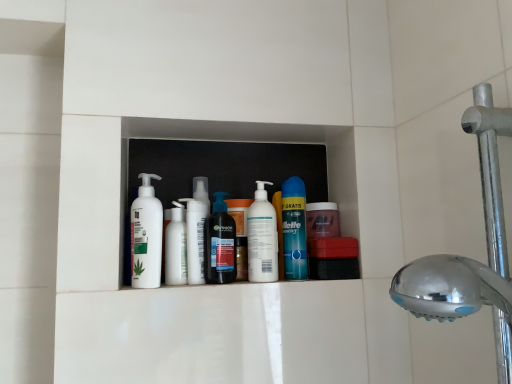
Question: From the image's perspective, is white matte lotion at center, acting as the 5th cleaning product starting from the right, located beneath white matte pump bottle at center, acting as the 4th cleaning product starting from the left?

Choices:
 (A) yes
 (B) no

Answer: (B)

Question: Is white matte lotion at center, acting as the 5th cleaning product starting from the right, outside of white matte pump bottle at center, which is counted as the 2th cleaning product, starting from the right?

Choices:
 (A) no
 (B) yes

Answer: (B)

Question: Does white matte lotion at center, acting as the first cleaning product starting from the left, lie behind white matte pump bottle at center, which is counted as the 2th cleaning product, starting from the right?

Choices:
 (A) no
 (B) yes

Answer: (A)

Question: Is white matte lotion at center, acting as the first cleaning product starting from the left, aimed at white matte pump bottle at center, which is counted as the 2th cleaning product, starting from the right?

Choices:
 (A) yes
 (B) no

Answer: (B)

Question: Is white matte lotion at center, acting as the first cleaning product starting from the left, closer to the viewer compared to white matte pump bottle at center, acting as the 4th cleaning product starting from the left?

Choices:
 (A) no
 (B) yes

Answer: (B)

Question: Choose the correct answer: Is chrome metallic shower head at right inside blue glossy can at center, which ranks as the fifth cleaning product in left-to-right order, or outside it?

Choices:
 (A) inside
 (B) outside

Answer: (B)

Question: In terms of size, does chrome metallic shower head at right appear bigger or smaller than blue glossy can at center, marked as the 1th cleaning product in a right-to-left arrangement?

Choices:
 (A) big
 (B) small

Answer: (A)

Question: Is point (487, 173) positioned closer to the camera than point (287, 276)?

Choices:
 (A) closer
 (B) farther

Answer: (A)

Question: Is chrome metallic shower head at right in front of or behind blue glossy can at center, which ranks as the fifth cleaning product in left-to-right order, in the image?

Choices:
 (A) behind
 (B) front

Answer: (B)

Question: Looking at the image, does white matte bottle at center, the fourth cleaning product from the right, seem bigger or smaller compared to translucent plastic bottle at center, which is the 3th cleaning product in right-to-left order?

Choices:
 (A) big
 (B) small

Answer: (B)

Question: From a real-world perspective, relative to translucent plastic bottle at center, marked as the 3th cleaning product in a left-to-right arrangement, is white matte bottle at center, the fourth cleaning product from the right, vertically above or below?

Choices:
 (A) above
 (B) below

Answer: (B)

Question: Does point (189, 225) appear closer or farther from the camera than point (214, 279)?

Choices:
 (A) farther
 (B) closer

Answer: (A)

Question: Which is correct: white matte bottle at center, positioned as the 2th cleaning product in left-to-right order, is inside translucent plastic bottle at center, which is the 3th cleaning product in right-to-left order, or outside of it?

Choices:
 (A) outside
 (B) inside

Answer: (A)

Question: From a real-world perspective, is blue glossy can at center, which ranks as the fifth cleaning product in left-to-right order, physically located above or below translucent plastic bottle at center, marked as the 3th cleaning product in a left-to-right arrangement?

Choices:
 (A) above
 (B) below

Answer: (A)

Question: Is blue glossy can at center, which ranks as the fifth cleaning product in left-to-right order, bigger or smaller than translucent plastic bottle at center, marked as the 3th cleaning product in a left-to-right arrangement?

Choices:
 (A) big
 (B) small

Answer: (B)